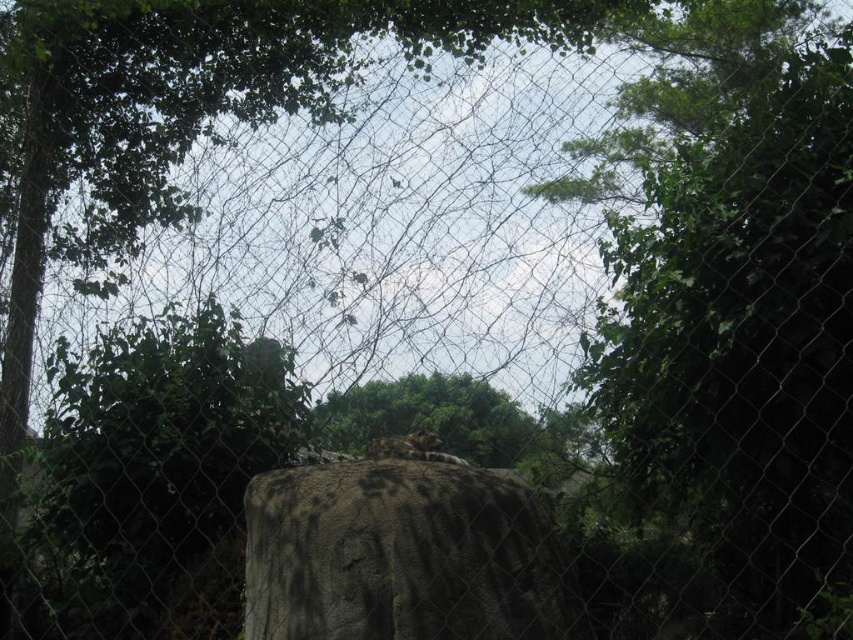
Question: Which object is positioned closest to the rough textured stone at center?

Choices:
 (A) brown fur tiger at center
 (B) green leafy tree at upper center

Answer: (A)

Question: Does green leafy tree at upper center appear over rough textured stone at center?

Choices:
 (A) no
 (B) yes

Answer: (B)

Question: Estimate the real-world distances between objects in this image. Which object is closer to the green leafy tree at upper center?

Choices:
 (A) rough textured stone at center
 (B) brown fur tiger at center

Answer: (B)

Question: Is rough textured stone at center positioned at the back of brown fur tiger at center?

Choices:
 (A) no
 (B) yes

Answer: (A)

Question: Which of the following is the farthest from the observer?

Choices:
 (A) (473, 486)
 (B) (833, 492)

Answer: (B)

Question: From the image, what is the correct spatial relationship of green leafy tree at upper center in relation to brown fur tiger at center?

Choices:
 (A) below
 (B) above

Answer: (B)